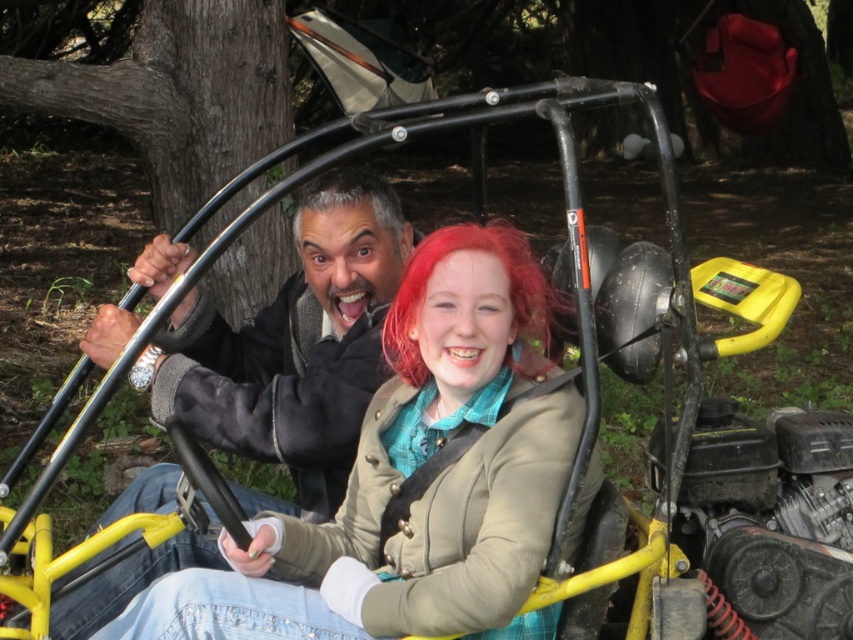
Does matte beige jacket at center have a lesser width compared to gray matte hair at center?

No.

Is matte beige jacket at center shorter than gray matte hair at center?

No, matte beige jacket at center is not shorter than gray matte hair at center.

Between point (460, 496) and point (375, 196), which one is positioned in front?

Point (460, 496)

The width and height of the screenshot is (853, 640). Identify the location of matte beige jacket at center. (410, 472).